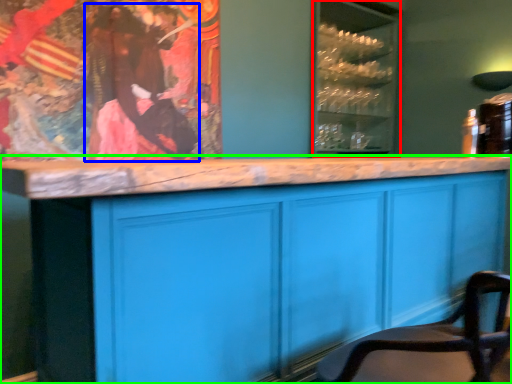
Question: Based on their relative distances, which object is farther from glass door (highlighted by a red box)? Choose from person (highlighted by a blue box) and cabinetry (highlighted by a green box).

Choices:
 (A) person
 (B) cabinetry

Answer: (B)